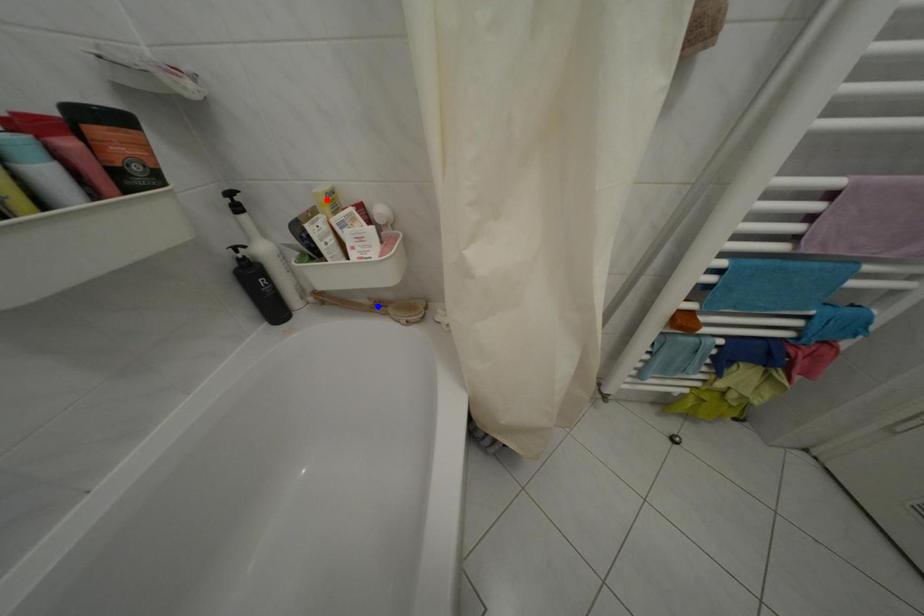
Question: In the image, two points are highlighted. Which point is nearer to the camera? Reply with the corresponding letter.

Choices:
 (A) blue point
 (B) red point

Answer: (B)